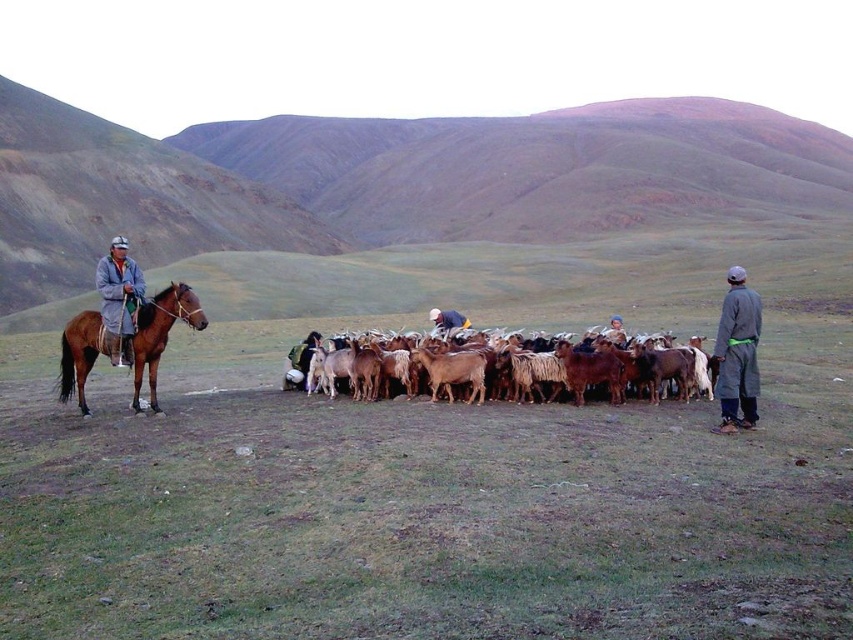
Can you confirm if gray woolen jacket at right is positioned to the left of green woolen jacket at center?

In fact, gray woolen jacket at right is to the right of green woolen jacket at center.

The height and width of the screenshot is (640, 853). Find the location of `gray woolen jacket at right`. gray woolen jacket at right is located at coordinates (737, 353).

Locate an element on the screen. The width and height of the screenshot is (853, 640). gray woolen jacket at right is located at coordinates [737, 353].

Between green grassland at center and brown glossy horse at left, which one appears on the left side from the viewer's perspective?

Positioned to the left is green grassland at center.

Is green grassland at center thinner than brown glossy horse at left?

No.

The image size is (853, 640). I want to click on green grassland at center, so click(387, 180).

Does green woolen jacket at center have a larger size compared to white woolen sweater at center?

Correct, green woolen jacket at center is larger in size than white woolen sweater at center.

This screenshot has height=640, width=853. Describe the element at coordinates (300, 360) in the screenshot. I see `green woolen jacket at center` at that location.

Locate an element on the screen. This screenshot has height=640, width=853. green woolen jacket at center is located at coordinates (300, 360).